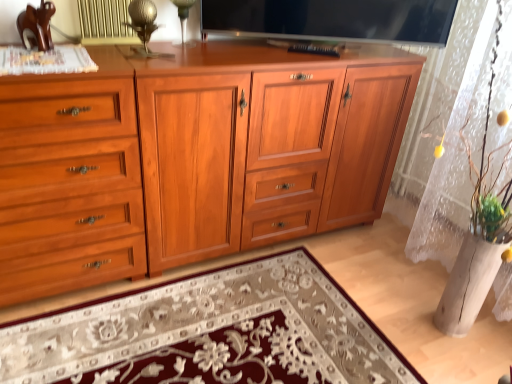
Question: From the image's perspective, does transparent glass table lamp at upper center, positioned as the 2th table lamp in front-to-back order, appear lower than matte wood cupboard at left?

Choices:
 (A) yes
 (B) no

Answer: (B)

Question: Is transparent glass table lamp at upper center, positioned as the 2th table lamp in front-to-back order, taller than matte wood cupboard at left?

Choices:
 (A) no
 (B) yes

Answer: (A)

Question: Is transparent glass table lamp at upper center, the 1th table lamp positioned from the back, with matte wood cupboard at left?

Choices:
 (A) no
 (B) yes

Answer: (A)

Question: Is transparent glass table lamp at upper center, positioned as the 2th table lamp in front-to-back order, to the left of matte wood cupboard at left from the viewer's perspective?

Choices:
 (A) yes
 (B) no

Answer: (B)

Question: Is transparent glass table lamp at upper center, the 1th table lamp positioned from the back, shorter than matte wood cupboard at left?

Choices:
 (A) yes
 (B) no

Answer: (A)

Question: Can you confirm if transparent glass table lamp at upper center, positioned as the 2th table lamp in front-to-back order, is wider than metallic gold table lamp at upper center, placed as the second table lamp when sorted from back to front?

Choices:
 (A) no
 (B) yes

Answer: (B)

Question: From a real-world perspective, is transparent glass table lamp at upper center, the 1th table lamp positioned from the back, under metallic gold table lamp at upper center, placed as the second table lamp when sorted from back to front?

Choices:
 (A) no
 (B) yes

Answer: (B)

Question: From a real-world perspective, is transparent glass table lamp at upper center, the 1th table lamp positioned from the back, over metallic gold table lamp at upper center, which is the first table lamp in front-to-back order?

Choices:
 (A) no
 (B) yes

Answer: (A)

Question: Does transparent glass table lamp at upper center, the 1th table lamp positioned from the back, appear on the left side of metallic gold table lamp at upper center, placed as the second table lamp when sorted from back to front?

Choices:
 (A) yes
 (B) no

Answer: (B)

Question: From the image's perspective, is transparent glass table lamp at upper center, positioned as the 2th table lamp in front-to-back order, beneath metallic gold table lamp at upper center, which is the first table lamp in front-to-back order?

Choices:
 (A) yes
 (B) no

Answer: (B)

Question: Considering the relative positions of transparent glass table lamp at upper center, positioned as the 2th table lamp in front-to-back order, and metallic gold table lamp at upper center, which is the first table lamp in front-to-back order, in the image provided, is transparent glass table lamp at upper center, positioned as the 2th table lamp in front-to-back order, behind metallic gold table lamp at upper center, which is the first table lamp in front-to-back order,?

Choices:
 (A) no
 (B) yes

Answer: (B)

Question: Is there a large distance between matte wood cupboard at left and flat screen tv at upper center?

Choices:
 (A) no
 (B) yes

Answer: (A)